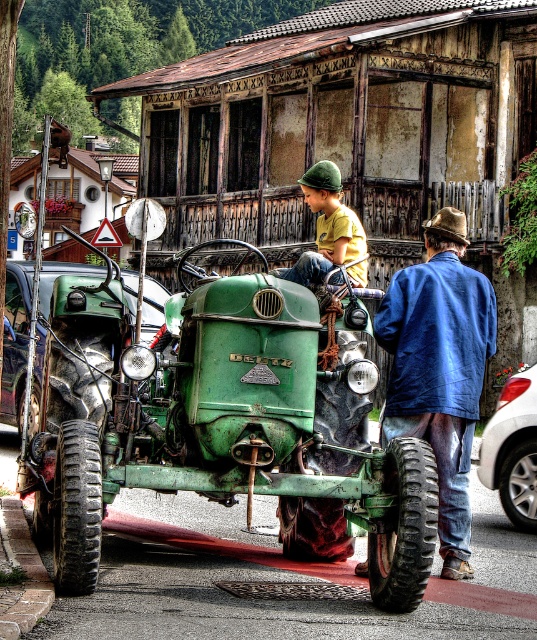
You are standing in the middle of the street and see the vintage green Deutz tractor in the foreground and the blue corduroy jacket at center. Which object is closer to you?

The vintage green Deutz tractor in the foreground is closer to you than the blue corduroy jacket at center because it is positioned prominently in the foreground according to the scene description.

You are standing at the point labeled as point (221, 424) in the image. What object are you facing directly?

The point labeled as point (221, 424) corresponds to the green matte tractor at center, so you are facing the green matte tractor at center directly.